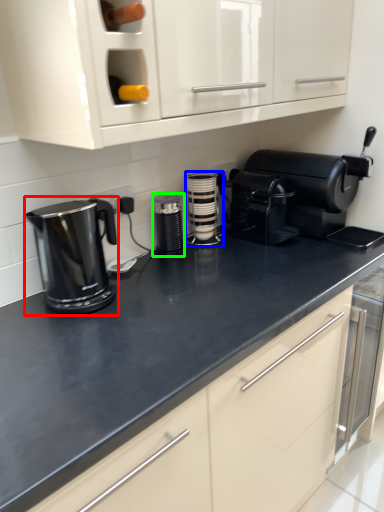
Question: Which is farther away from home appliance (highlighted by a red box)? kitchen appliance (highlighted by a blue box) or kitchen appliance (highlighted by a green box)?

Choices:
 (A) kitchen appliance
 (B) kitchen appliance

Answer: (A)